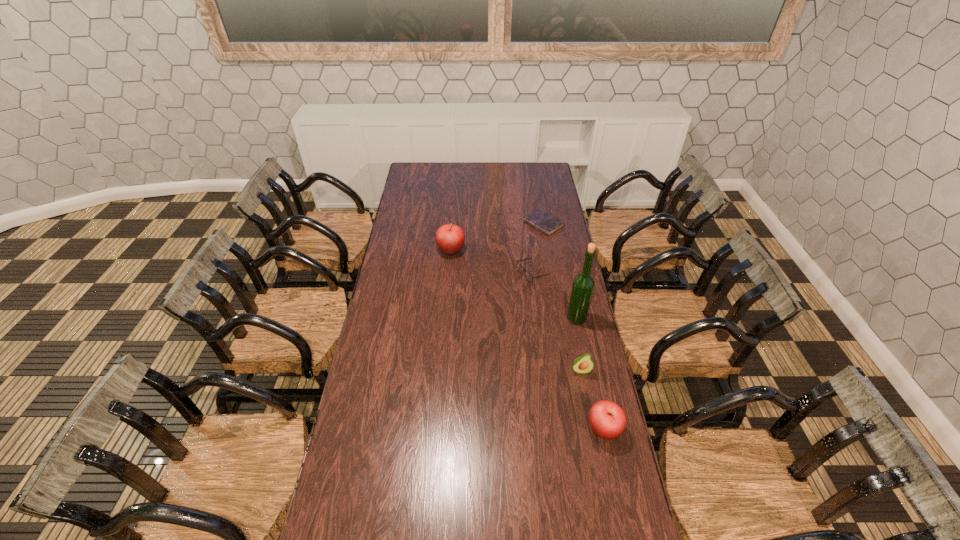
Where is `spectacles located at the right edge`? This screenshot has width=960, height=540. spectacles located at the right edge is located at coordinates (528, 276).

Find the location of a particular element. The width and height of the screenshot is (960, 540). liquor situated at the right edge is located at coordinates (583, 285).

The width and height of the screenshot is (960, 540). What are the coordinates of `diary positioned at the right edge` in the screenshot? It's located at (541, 220).

Find the location of a particular element. The height and width of the screenshot is (540, 960). avocado that is at the right edge is located at coordinates (583, 364).

In the image, there is a desktop. Identify the location of vacant space at the far edge. Image resolution: width=960 pixels, height=540 pixels. (467, 171).

Find the location of a particular element. This screenshot has height=540, width=960. vacant space at the near edge is located at coordinates (499, 501).

Identify the location of blank area at the left edge. The height and width of the screenshot is (540, 960). (335, 480).

Locate an element on the screen. free region at the right edge of the desktop is located at coordinates (540, 195).

Identify the location of vacant space at the far left corner. The image size is (960, 540). (410, 179).

Find the location of a particular element. The width and height of the screenshot is (960, 540). vacant area at the far right corner is located at coordinates (529, 165).